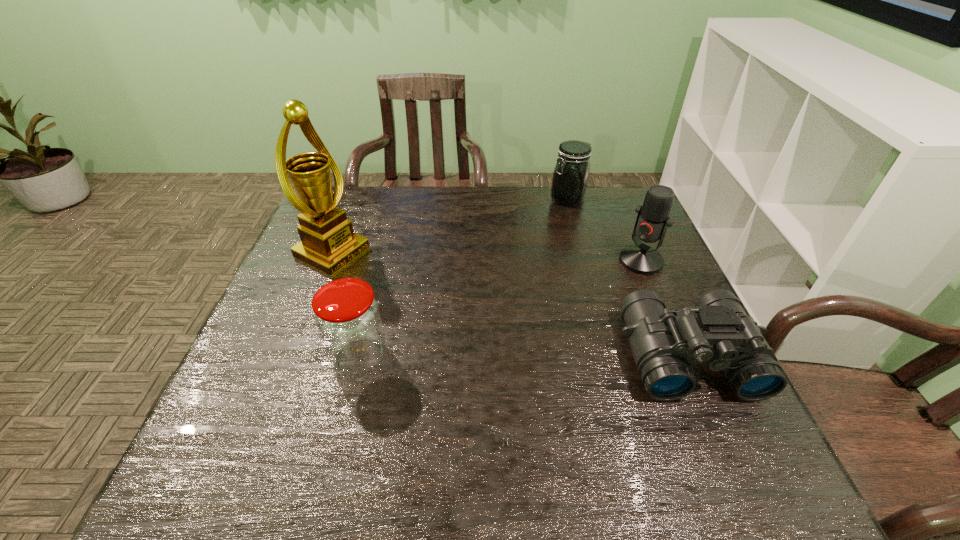
The image size is (960, 540). Find the location of `vacant space located 0.200m on the front-facing side of the award`. vacant space located 0.200m on the front-facing side of the award is located at coordinates (416, 293).

Identify the location of vacant space located 0.310m on the front-facing side of the award. (451, 310).

In order to click on free space located on the front-facing side of the award in this screenshot , I will do [x=442, y=306].

The height and width of the screenshot is (540, 960). I want to click on vacant space located 0.210m on the side of the second tallest object with the red ring, so click(584, 310).

Locate an element on the screen. The width and height of the screenshot is (960, 540). vacant area located on the side of the second tallest object with the red ring is located at coordinates (547, 342).

In order to click on free point located 0.310m on the side of the second tallest object with the red ring in this screenshot , I will do `click(559, 333)`.

Image resolution: width=960 pixels, height=540 pixels. I want to click on object at the far edge, so click(x=570, y=177).

This screenshot has width=960, height=540. In order to click on object positioned at the near edge in this screenshot , I will do `click(717, 330)`.

The image size is (960, 540). I want to click on object present at the left edge, so click(328, 243).

Where is `binoculars that is at the right edge`? binoculars that is at the right edge is located at coordinates (717, 330).